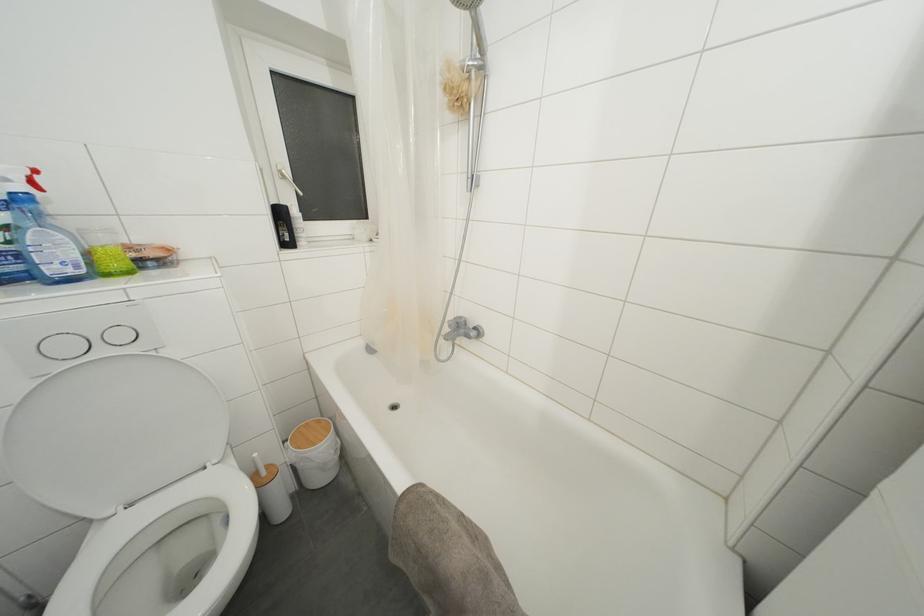
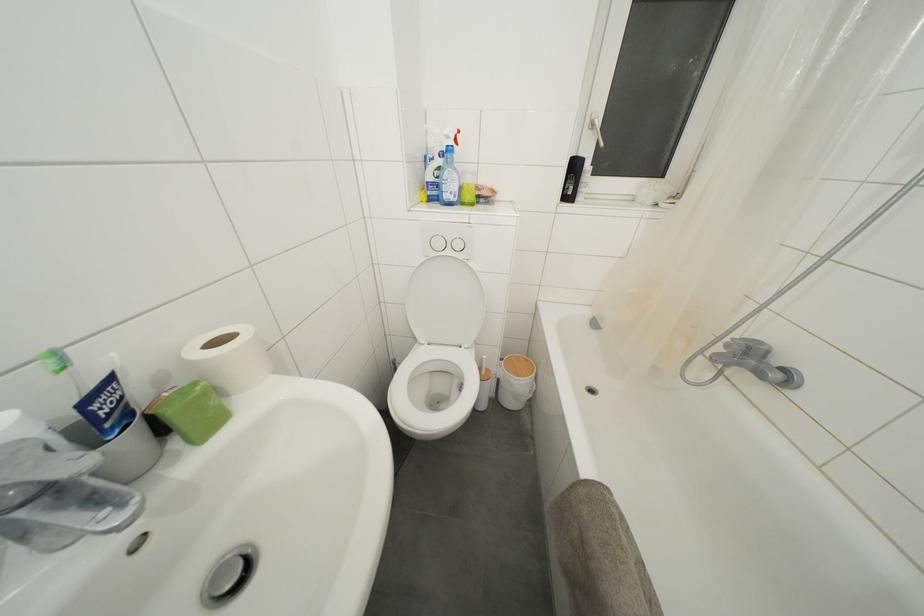
Find the pixel in the second image that matches the point at 269,477 in the first image.

(488, 378)